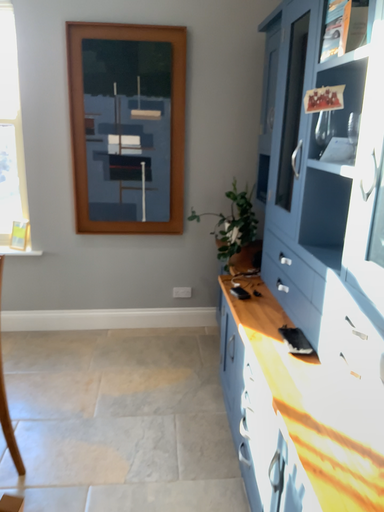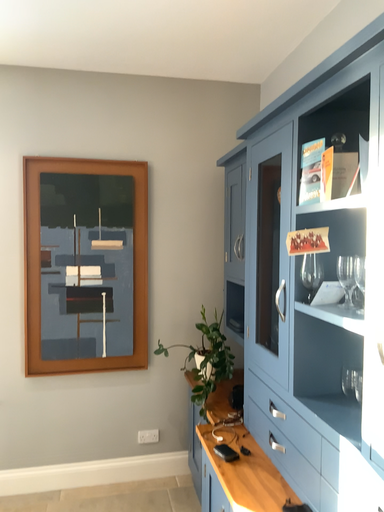
Question: How did the camera likely rotate when shooting the video?

Choices:
 (A) rotated upward
 (B) rotated downward

Answer: (A)